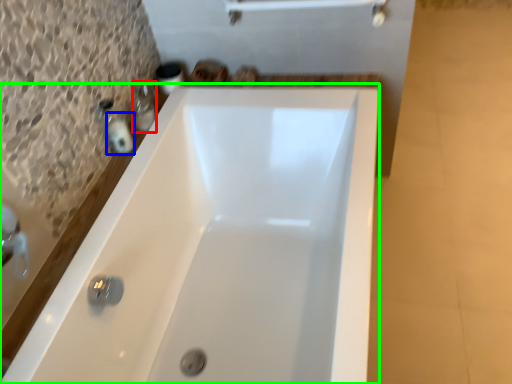
Question: Based on their relative distances, which object is nearer to toiletry (highlighted by a red box)? Choose from toiletry (highlighted by a blue box) and bathtub (highlighted by a green box).

Choices:
 (A) toiletry
 (B) bathtub

Answer: (A)